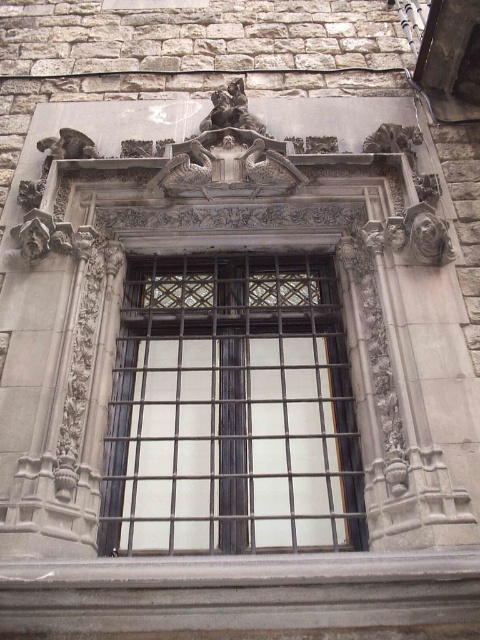
Does metallic grid window at center appear over polished bronze statue at upper center?

No.

Is the position of metallic grid window at center less distant than that of polished bronze statue at upper center?

Yes, metallic grid window at center is closer to the viewer.

Is point (156, 484) farther from camera compared to point (265, 132)?

No, it is in front of (265, 132).

Locate an element on the screen. metallic grid window at center is located at coordinates (230, 412).

Between metallic grid window at center and gray stone gargoyle at upper center, which one has more height?

metallic grid window at center is taller.

Does metallic grid window at center lie behind gray stone gargoyle at upper center?

No.

Is point (276, 540) positioned in front of point (203, 170)?

Yes.

This screenshot has height=640, width=480. In order to click on metallic grid window at center in this screenshot , I will do `click(230, 412)`.

Does gray stone gargoyle at upper center appear under dark gray stone gargoyle at upper left?

Yes.

The width and height of the screenshot is (480, 640). Identify the location of gray stone gargoyle at upper center. (186, 168).